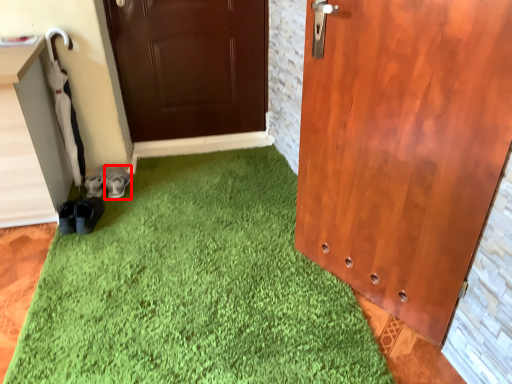
Question: From the image's perspective, where is footwear (annotated by the red box) located in relation to footwear in the image?

Choices:
 (A) above
 (B) below

Answer: (A)